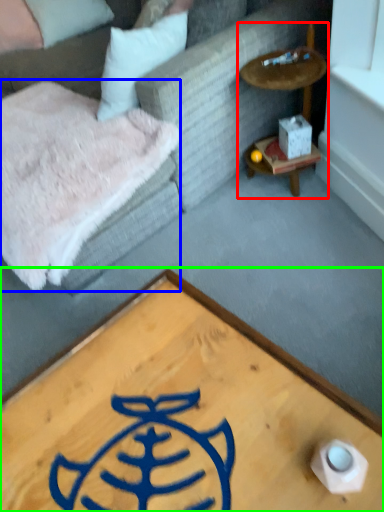
Question: Based on their relative distances, which object is farther from cocktail table (highlighted by a red box)? Choose from blanket (highlighted by a blue box) and coffee table (highlighted by a green box).

Choices:
 (A) blanket
 (B) coffee table

Answer: (B)